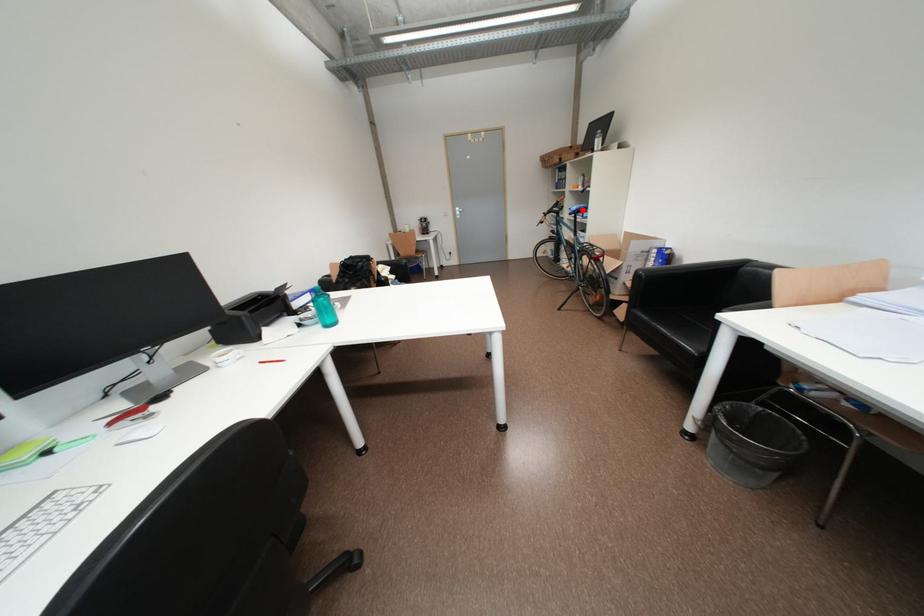
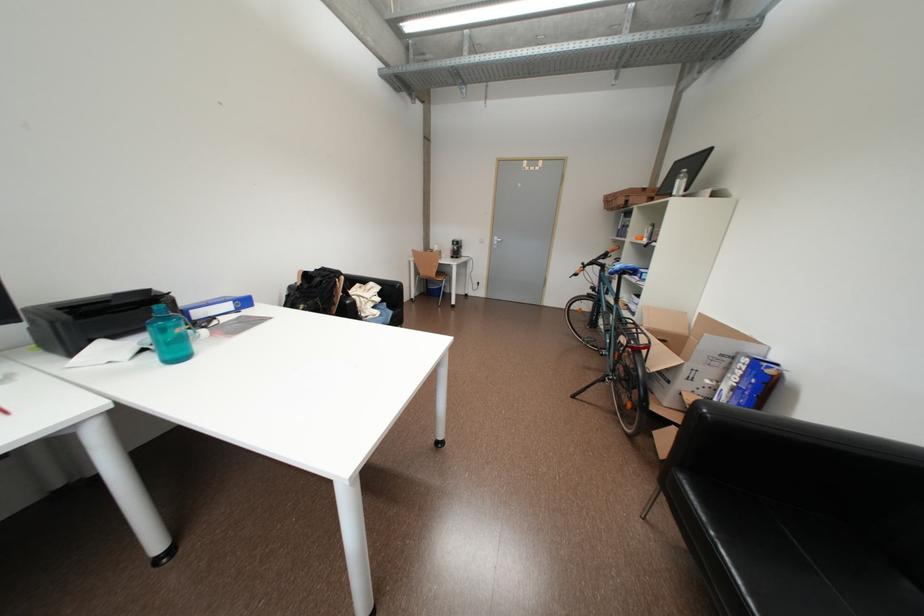
Where in the second image is the point corresponding to the highlighted location from the first image?

(626, 268)